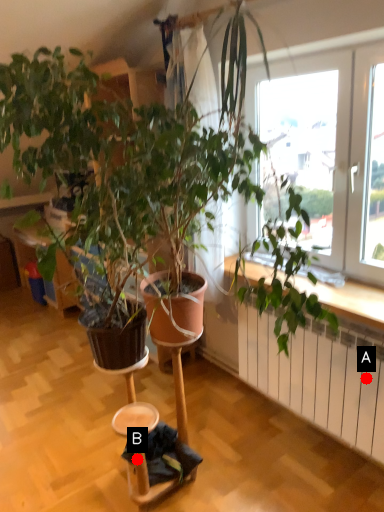
Question: Two points are circled on the image, labeled by A and B beside each circle. Which point is farther from the camera taking this photo?

Choices:
 (A) A is further
 (B) B is further

Answer: (A)